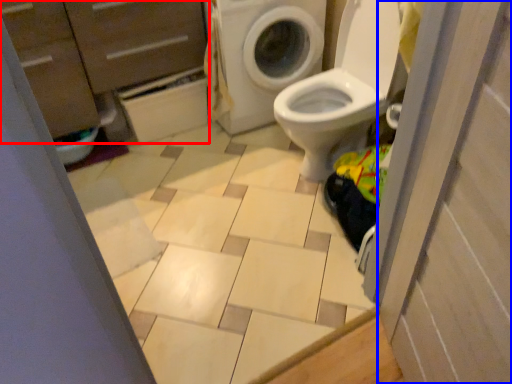
Question: Which object is closer to the camera taking this photo, dresser (highlighted by a red box) or screen door (highlighted by a blue box)?

Choices:
 (A) dresser
 (B) screen door

Answer: (B)